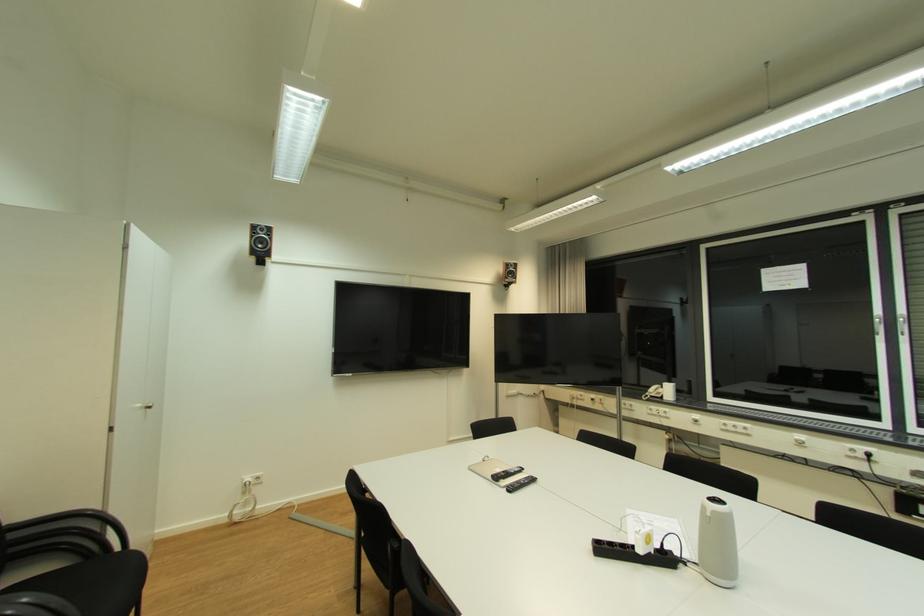
What do you see at coordinates (75, 521) in the screenshot? The image size is (924, 616). I see `the black chair armrest` at bounding box center [75, 521].